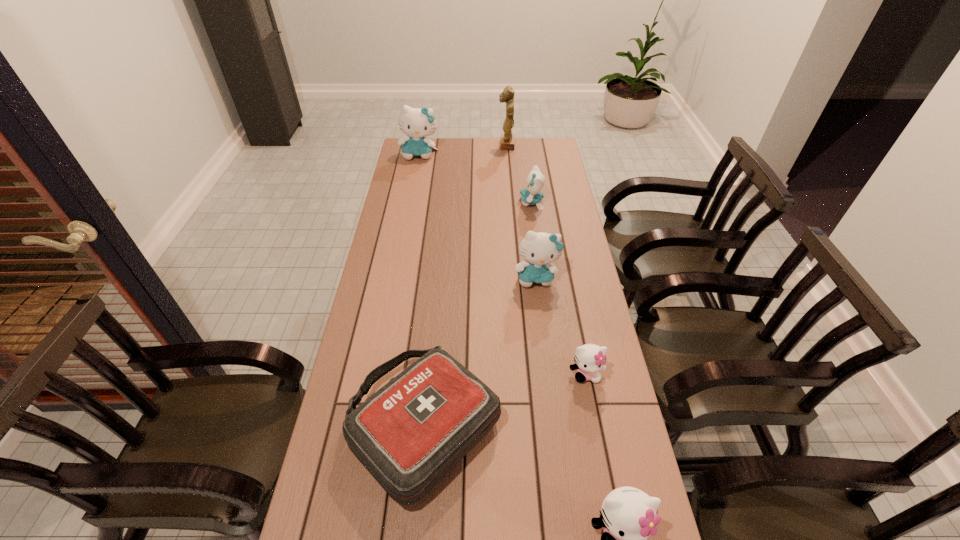
Locate which blue kitten ranks second in proximity to the smaller white kitten. Please provide its 2D coordinates. Your answer should be formatted as a tuple, i.e. [(x, y)], where the tuple contains the x and y coordinates of a point satisfying the conditions above.

[(531, 195)]

At what (x,y) coordinates should I click in order to perform the action: click on blank area in the image that satisfies the following two spatial constraints: 1. on the face of the biggest blue kitten; 2. on the right side of the red first-aid kit. Please return your answer as a coordinate pair (x, y). This screenshot has height=540, width=960. Looking at the image, I should click on (369, 424).

The image size is (960, 540). Identify the location of free space that satisfies the following two spatial constraints: 1. on the front-facing side of the tallest object; 2. on the face of the farthest blue kitten. (507, 154).

What are the coordinates of `vacant point that satisfies the following two spatial constraints: 1. on the face of the smallest blue kitten; 2. on the front side of the red first-aid kit` in the screenshot? It's located at (563, 424).

Locate an element on the screen. The image size is (960, 540). free location that satisfies the following two spatial constraints: 1. on the face of the fifth nearest object; 2. on the front side of the first-aid kit is located at coordinates (563, 424).